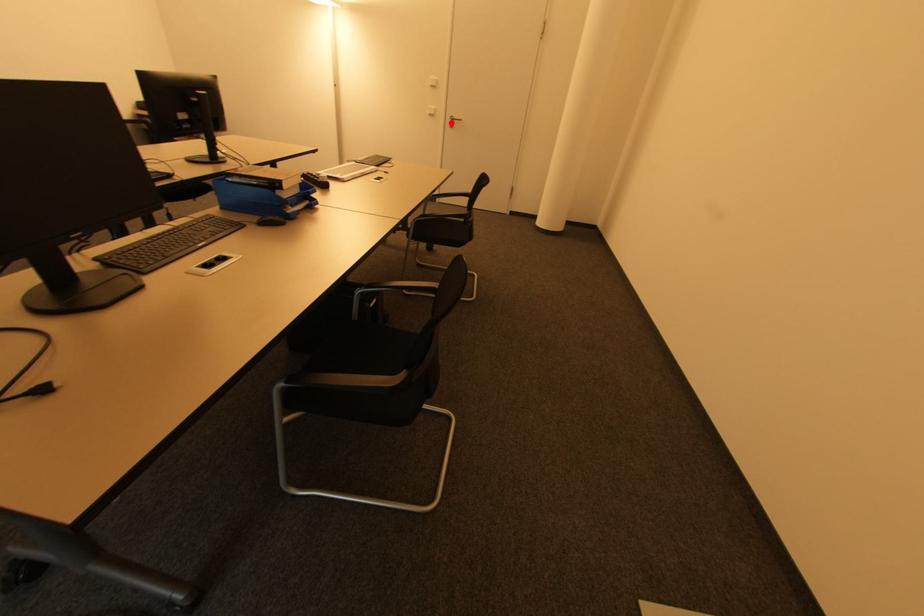
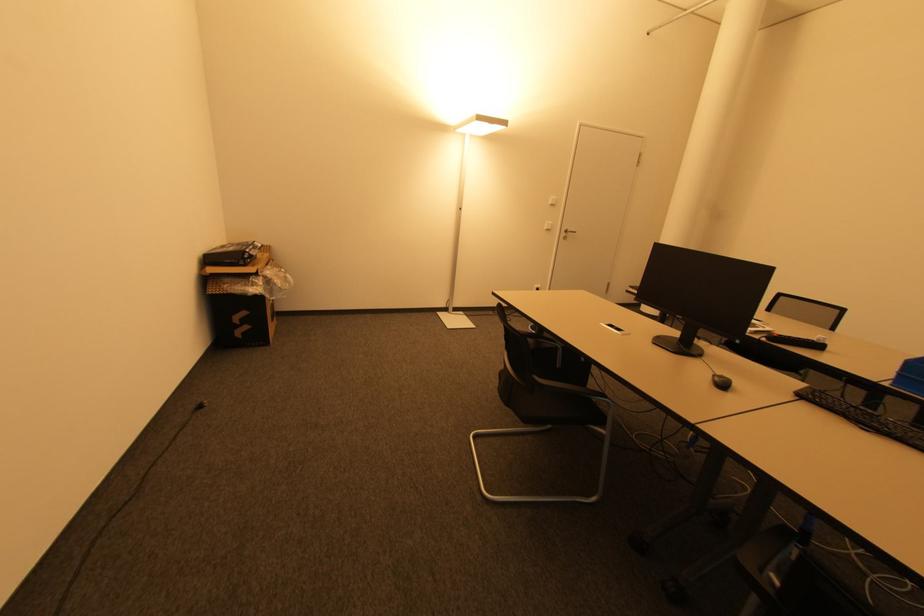
In the second image, find the point that corresponds to the highlighted location in the first image.

(565, 235)